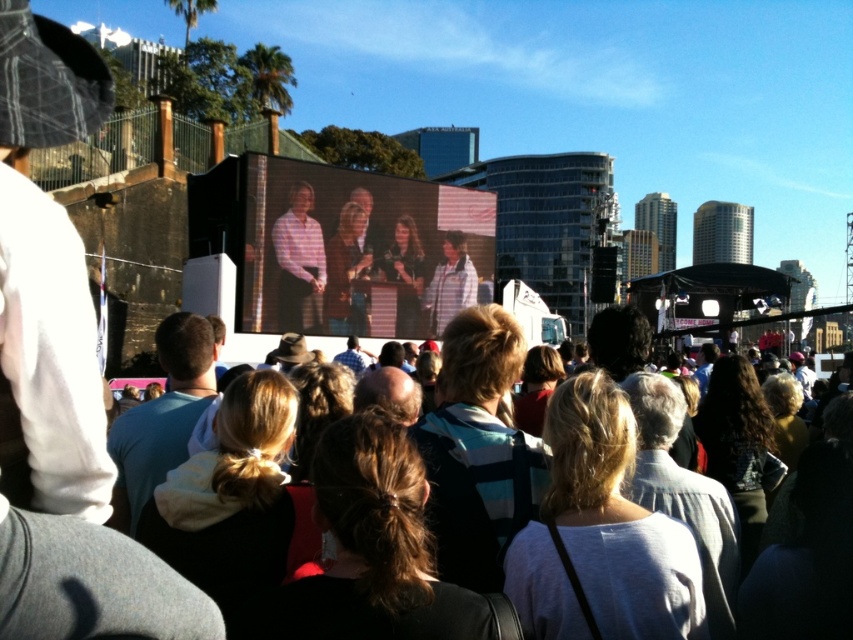
Question: Can you confirm if light brown hair at center is wider than plaid shirt at center?

Choices:
 (A) yes
 (B) no

Answer: (A)

Question: Is matte screen at center below light brown hair at center?

Choices:
 (A) yes
 (B) no

Answer: (B)

Question: Which is nearer to the matte screen at center?

Choices:
 (A) plaid shirt at center
 (B) light brown hair at center

Answer: (A)

Question: Which point is farther to the camera?

Choices:
 (A) light brown hair at center
 (B) plaid shirt at center

Answer: (B)

Question: Which point is closer to the camera?

Choices:
 (A) matte screen at center
 (B) light brown hair at center
 (C) plaid shirt at center

Answer: (B)

Question: Does matte screen at center appear on the right side of light brown hair at center?

Choices:
 (A) yes
 (B) no

Answer: (B)